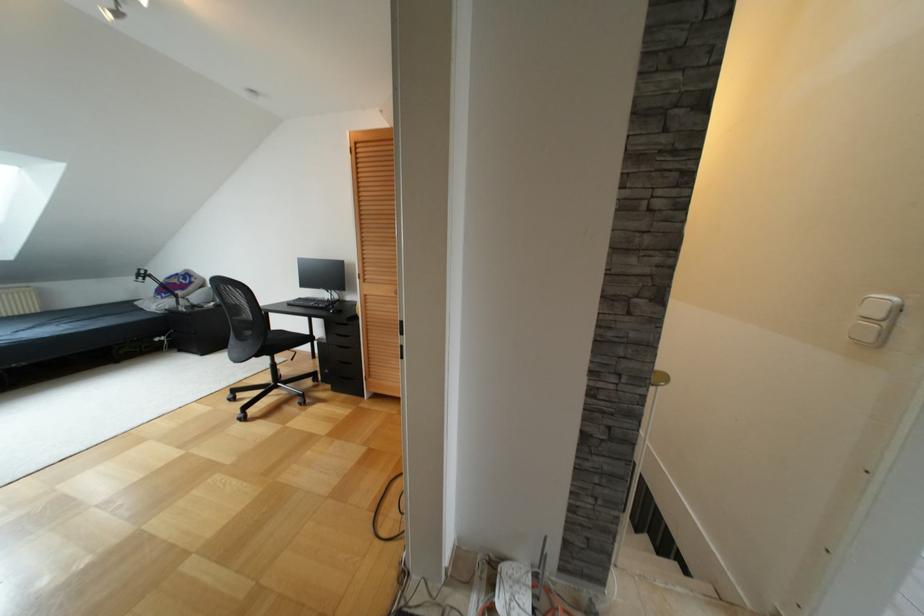
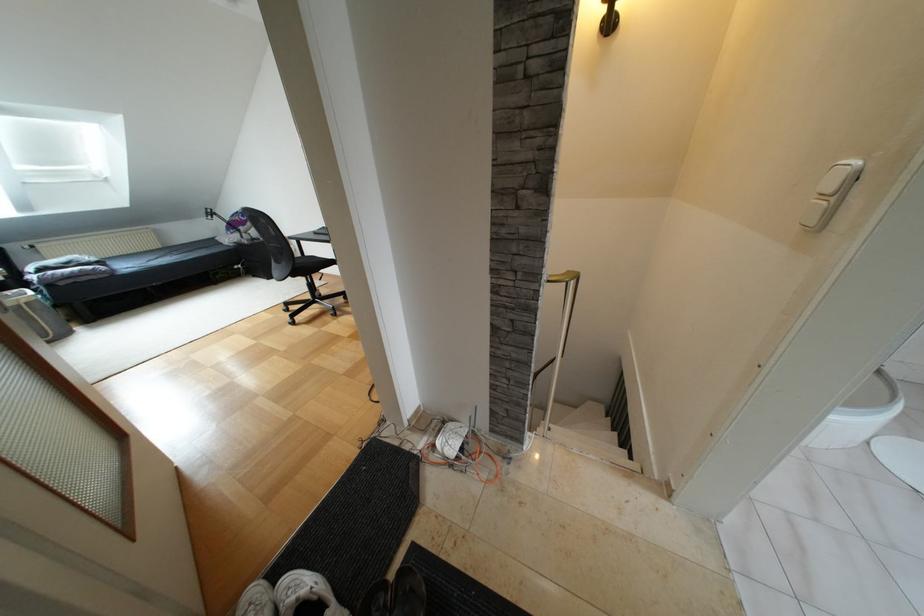
In the second image, find the point that corresponds to point (883, 323) in the first image.

(833, 198)